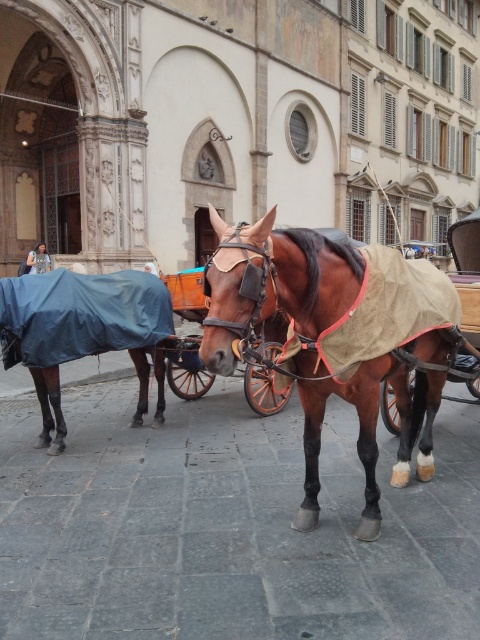
You are a horse trainer assessing the space between two horses. The brown glossy horse at center and the blue fabric covered horse at lower left are both in the stable. If the stable door is 2 meters wide, can both horses pass through the door together?

The brown glossy horse at center is wider than the blue fabric covered horse at lower left. Since the stable door is 2 meters wide, both horses can pass through together as their combined width would likely be less than 2 meters, but they may need to walk side by side carefully.

You are a knight in a historical European setting. You see a brown glossy horse at center and a blue fabric covered horse at lower left. Which horse is positioned to the east?

The brown glossy horse at center is to the right of the blue fabric covered horse at lower left. Since the blue fabric covered horse at lower left is on the left side, the brown glossy horse at center would be positioned to the east.

You are an artist sketching the scene and need to place the brown glossy horse at center accurately. According to the coordinates provided, where should you position it on your paper?

The brown glossy horse at center should be positioned at coordinates point (317,342).